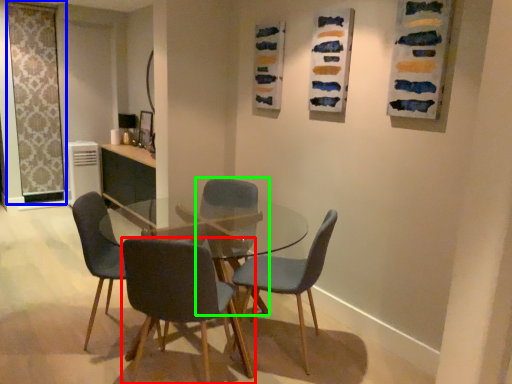
Question: Which object is the farthest from chair (highlighted by a red box)? Choose among these: screen door (highlighted by a blue box) or chair (highlighted by a green box).

Choices:
 (A) screen door
 (B) chair

Answer: (A)